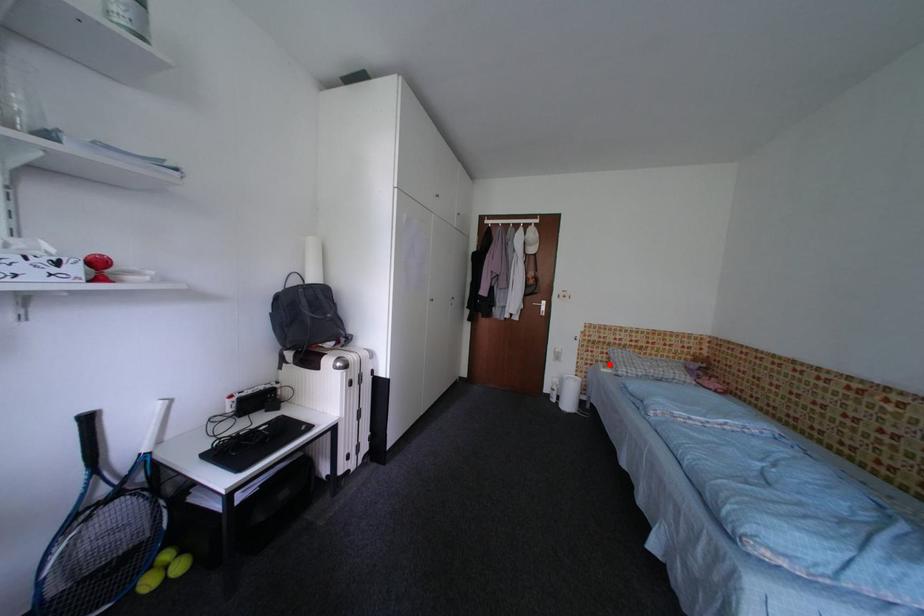
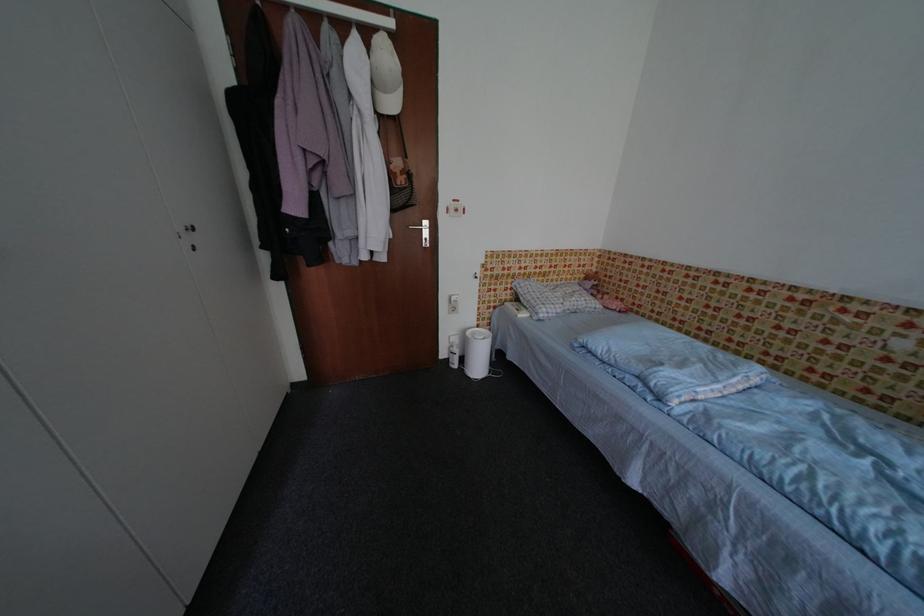
Question: I am providing you with two images of the same scene from different viewpoints. A red point is shown in image1. For the corresponding object point in image2, is it positioned nearer or farther from the camera?

Choices:
 (A) Nearer
 (B) Farther

Answer: (A)